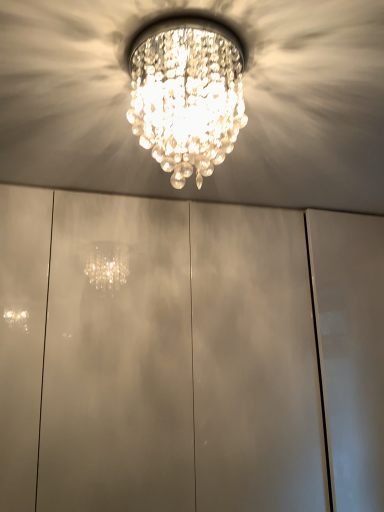
Question: From the image's perspective, is clear crystal chandelier at center below glossy white cabinet at center?

Choices:
 (A) no
 (B) yes

Answer: (A)

Question: Can you confirm if clear crystal chandelier at center is positioned to the left of glossy white cabinet at center?

Choices:
 (A) no
 (B) yes

Answer: (B)

Question: Is clear crystal chandelier at center further to camera compared to glossy white cabinet at center?

Choices:
 (A) yes
 (B) no

Answer: (B)

Question: From a real-world perspective, is clear crystal chandelier at center located beneath glossy white cabinet at center?

Choices:
 (A) yes
 (B) no

Answer: (B)

Question: Is clear crystal chandelier at center positioned before glossy white cabinet at center?

Choices:
 (A) no
 (B) yes

Answer: (B)

Question: Considering the relative sizes of clear crystal chandelier at center and glossy white cabinet at center in the image provided, is clear crystal chandelier at center shorter than glossy white cabinet at center?

Choices:
 (A) no
 (B) yes

Answer: (B)

Question: From a real-world perspective, is glossy white cabinet at center on clear crystal chandelier at center?

Choices:
 (A) no
 (B) yes

Answer: (A)

Question: Considering the relative sizes of glossy white cabinet at center and clear crystal chandelier at center in the image provided, is glossy white cabinet at center taller than clear crystal chandelier at center?

Choices:
 (A) yes
 (B) no

Answer: (A)

Question: Considering the relative sizes of glossy white cabinet at center and clear crystal chandelier at center in the image provided, is glossy white cabinet at center shorter than clear crystal chandelier at center?

Choices:
 (A) yes
 (B) no

Answer: (B)

Question: Would you say glossy white cabinet at center is a long distance from clear crystal chandelier at center?

Choices:
 (A) yes
 (B) no

Answer: (B)

Question: Is glossy white cabinet at center oriented towards clear crystal chandelier at center?

Choices:
 (A) no
 (B) yes

Answer: (B)

Question: Considering the relative sizes of glossy white cabinet at center and clear crystal chandelier at center in the image provided, is glossy white cabinet at center bigger than clear crystal chandelier at center?

Choices:
 (A) no
 (B) yes

Answer: (B)

Question: From a real-world perspective, is clear crystal chandelier at center above or below glossy white cabinet at center?

Choices:
 (A) above
 (B) below

Answer: (A)